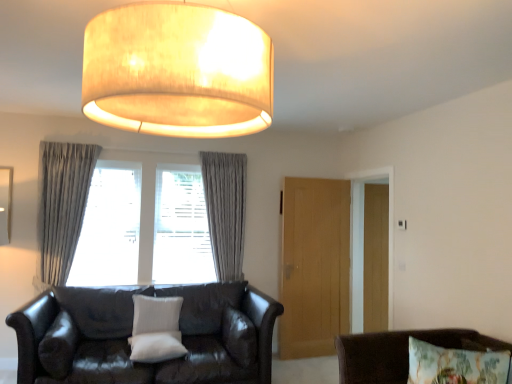
Describe the element at coordinates (376, 258) in the screenshot. I see `transparent wood door at right, which is counted as the first glass door, starting from the right` at that location.

The height and width of the screenshot is (384, 512). What do you see at coordinates (226, 210) in the screenshot?
I see `gray textured curtains at center` at bounding box center [226, 210].

Find the location of a particular element. The height and width of the screenshot is (384, 512). white soft pillow at center, placed as the first pillow when sorted from front to back is located at coordinates (156, 347).

Identify the location of transparent wood door at right, which is the 2th glass door in left-to-right order. (376, 258).

This screenshot has width=512, height=384. I want to click on window on the left of light brown wooden door at center, the 2th glass door from the back, so click(x=226, y=210).

Is gray textured curtains at center not near light brown wooden door at center, which is the 2th glass door in right-to-left order?

No, there isn't a large distance between gray textured curtains at center and light brown wooden door at center, which is the 2th glass door in right-to-left order.

Which object is wider, gray textured curtains at center or light brown wooden door at center, acting as the first glass door starting from the left?

gray textured curtains at center.

Looking at the image, does gray textured curtains at center seem bigger or smaller compared to light brown wooden door at center, acting as the first glass door starting from the left?

In the image, gray textured curtains at center appears to be larger than light brown wooden door at center, acting as the first glass door starting from the left.

Can you confirm if white textured pillow at center, the 2th pillow from the front, is taller than gray fabric curtain at left, the 1th curtain viewed from the front?

Incorrect, the height of white textured pillow at center, the 2th pillow from the front, is not larger of that of gray fabric curtain at left, the 1th curtain viewed from the front.

Image resolution: width=512 pixels, height=384 pixels. Find the location of `pillow that is the 1st one when counting forward from the gray fabric curtain at left, which is counted as the 2th curtain, starting from the right`. pillow that is the 1st one when counting forward from the gray fabric curtain at left, which is counted as the 2th curtain, starting from the right is located at coordinates (156, 314).

How many degrees apart are the facing directions of gray fabric curtain at left, the 1th curtain from the left, and white textured pillow at center, the 2th pillow from the front?

They differ by 3.97e-05 degrees in their facing directions.

Looking at the image, does gray fabric curtain at left, the 1th curtain from the left, seem bigger or smaller compared to white textured pillow at center, the 2th pillow from the front?

In the image, gray fabric curtain at left, the 1th curtain from the left, appears to be larger than white textured pillow at center, the 2th pillow from the front.

At what (x,y) coordinates should I click in order to perform the action: click on the 1st pillow in front of the gray fabric curtain at left, which is counted as the 2th curtain, starting from the right, counting from the anchor's position. Please return your answer as a coordinate pair (x, y). Looking at the image, I should click on (156, 314).

Could you tell me if gray fabric curtain at left, the 1th curtain viewed from the front, is turned towards white textured pillow at center, the 2th pillow from the front?

No, gray fabric curtain at left, the 1th curtain viewed from the front, does not turn towards white textured pillow at center, the 2th pillow from the front.

Does point (233, 209) come behind point (41, 380)?

That is True.

Is gray textured curtains at center facing away from leather couch with pillows at lower left?

No, gray textured curtains at center is not facing the opposite direction of leather couch with pillows at lower left.

This screenshot has width=512, height=384. What are the coordinates of `lamp that appears in front of the leather couch with pillows at lower left` in the screenshot? It's located at (177, 71).

From the image's perspective, which one is positioned higher, matte beige lampshade at upper center or leather couch with pillows at lower left?

matte beige lampshade at upper center appears higher in the image.

How far apart are matte beige lampshade at upper center and leather couch with pillows at lower left?

6.89 feet.

From a real-world perspective, does matte beige lampshade at upper center stand above leather couch with pillows at lower left?

Correct, in the physical world, matte beige lampshade at upper center is higher than leather couch with pillows at lower left.

From a real-world perspective, starting from the leather couch with pillows at lower left, which curtain is the 2nd one vertically above it? Please provide its 2D coordinates.

[(225, 210)]

Based on the photo, does gray textured curtain at center, positioned as the first curtain in back-to-front order, have a greater width compared to leather couch with pillows at lower left?

No.

How many degrees apart are the facing directions of gray textured curtain at center, positioned as the first curtain in back-to-front order, and leather couch with pillows at lower left?

0.000122 degrees separate the facing orientations of gray textured curtain at center, positioned as the first curtain in back-to-front order, and leather couch with pillows at lower left.

Is gray textured curtain at center, positioned as the first curtain in back-to-front order, at the right side of leather couch with pillows at lower left?

Correct, you'll find gray textured curtain at center, positioned as the first curtain in back-to-front order, to the right of leather couch with pillows at lower left.

Is gray textured curtain at center, which is the 2th curtain from front to back, far away from gray fabric curtain at left, which appears as the 2th curtain when viewed from the back?

Yes, gray textured curtain at center, which is the 2th curtain from front to back, and gray fabric curtain at left, which appears as the 2th curtain when viewed from the back, are quite far apart.

Considering the positions of points (239, 241) and (79, 213), is point (239, 241) farther from camera compared to point (79, 213)?

Yes, point (239, 241) is behind point (79, 213).

Locate an element on the screen. curtain lying behind the gray fabric curtain at left, the 1th curtain viewed from the front is located at coordinates (225, 210).

Where is `the 1st glass door behind the gray textured curtains at center`? Image resolution: width=512 pixels, height=384 pixels. the 1st glass door behind the gray textured curtains at center is located at coordinates (314, 266).

Identify the location of the 1st pillow below when counting from the gray fabric curtain at left, which is counted as the 2th curtain, starting from the right (from the image's perspective). This screenshot has width=512, height=384. click(156, 314).

When comparing their distances from white textured pillow at center, the 2th pillow from the front, does light brown wooden door at center, acting as the first glass door starting from the left, or transparent wood door at right, which is the 2th glass door in left-to-right order, seem closer?

light brown wooden door at center, acting as the first glass door starting from the left, is positioned closer to the anchor white textured pillow at center, the 2th pillow from the front.

When comparing their distances from white soft pillow at center, the 2th pillow in the back-to-front sequence, does gray textured curtain at center, which is counted as the 2th curtain, starting from the left, or floral fabric cushion at lower right seem closer?

Among the two, gray textured curtain at center, which is counted as the 2th curtain, starting from the left, is located nearer to white soft pillow at center, the 2th pillow in the back-to-front sequence.

Considering their positions, is leather couch with pillows at lower left positioned further to matte beige lampshade at upper center than gray textured curtains at center?

Among the two, gray textured curtains at center is located further to matte beige lampshade at upper center.

Which object lies nearer to the anchor point white soft pillow at center, the 2th pillow in the back-to-front sequence, transparent wood door at right, marked as the first glass door in a back-to-front arrangement, or floral fabric cushion at lower right?

Among the two, floral fabric cushion at lower right is located nearer to white soft pillow at center, the 2th pillow in the back-to-front sequence.

Looking at the image, which one is located closer to gray textured curtain at center, which is the 2th curtain from front to back, white textured pillow at center, the 2th pillow from the front, or transparent wood door at right, which is the 2th glass door in left-to-right order?

The object closer to gray textured curtain at center, which is the 2th curtain from front to back, is white textured pillow at center, the 2th pillow from the front.

Considering their positions, is matte beige lampshade at upper center positioned further to white soft pillow at center, the 2th pillow in the back-to-front sequence, than gray textured curtain at center, which is counted as the 2th curtain, starting from the left?

matte beige lampshade at upper center is further to white soft pillow at center, the 2th pillow in the back-to-front sequence.

Estimate the real-world distances between objects in this image. Which object is further from matte beige lampshade at upper center, gray fabric curtain at left, which is counted as the 2th curtain, starting from the right, or white textured pillow at center, the 2th pillow from the front?

gray fabric curtain at left, which is counted as the 2th curtain, starting from the right, is positioned further to the anchor matte beige lampshade at upper center.

Considering their positions, is leather couch with pillows at lower left positioned further to gray fabric curtain at left, the 1th curtain viewed from the front, than gray textured curtains at center?

Among the two, gray textured curtains at center is located further to gray fabric curtain at left, the 1th curtain viewed from the front.

Identify the location of studio couch between gray textured curtains at center and transparent wood door at right, marked as the first glass door in a back-to-front arrangement. (131, 331).

Find the location of a particular element. This screenshot has width=512, height=384. studio couch positioned between matte beige lampshade at upper center and light brown wooden door at center, the 2th glass door from the back, from near to far is located at coordinates (131, 331).

The width and height of the screenshot is (512, 384). What are the coordinates of `window situated between gray fabric curtain at left, which is counted as the 2th curtain, starting from the right, and floral fabric cushion at lower right from left to right` in the screenshot? It's located at (226, 210).

This screenshot has width=512, height=384. What are the coordinates of `curtain between leather couch with pillows at lower left and transparent wood door at right, acting as the 2th glass door starting from the front, in the horizontal direction` in the screenshot? It's located at [x=225, y=210].